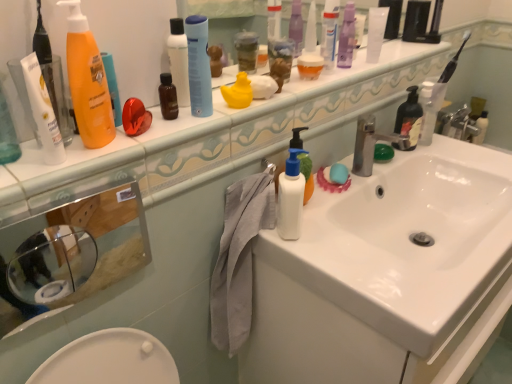
Locate an element on the screen. empty space that is to the right of black matte soap dispenser at right, which ranks as the 3th toiletry in back-to-front order is located at coordinates (459, 154).